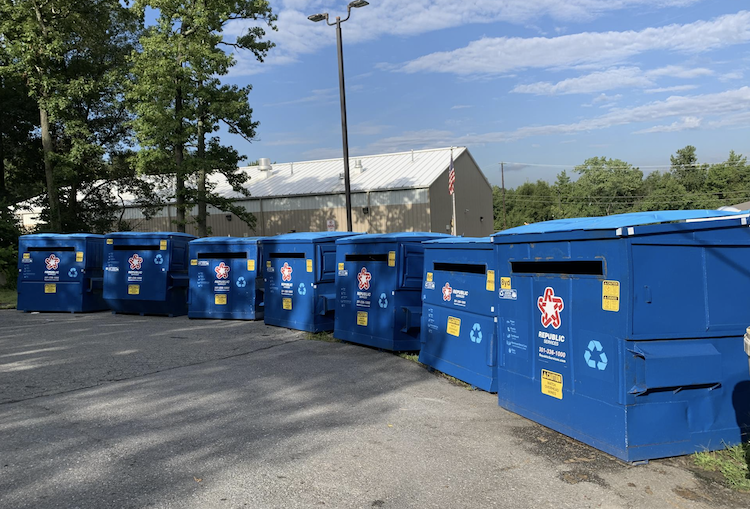
This screenshot has height=509, width=750. I want to click on recycle bins, so click(x=56, y=273), click(x=135, y=271), click(x=225, y=278), click(x=291, y=280), click(x=370, y=280), click(x=453, y=294), click(x=566, y=302).